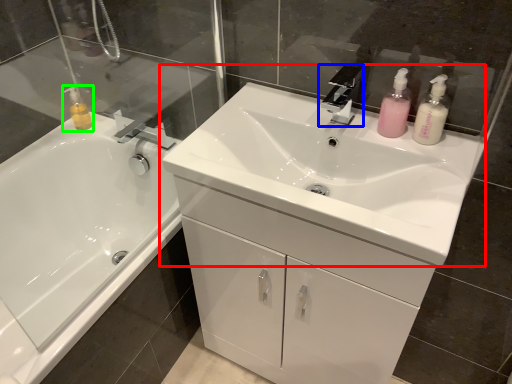
Question: Based on their relative distances, which object is farther from sink (highlighted by a red box)? Choose from tap (highlighted by a blue box) and toiletry (highlighted by a green box).

Choices:
 (A) tap
 (B) toiletry

Answer: (B)